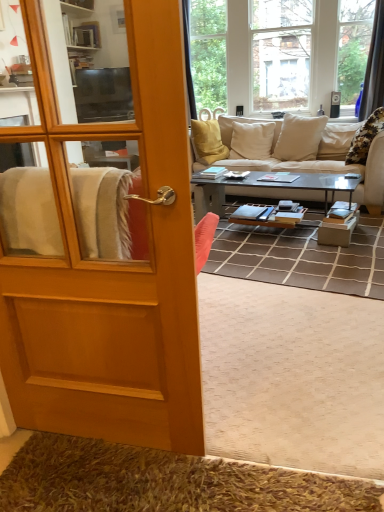
Find the location of a particular element. brown shaggy rug at lower left is located at coordinates (163, 482).

Measure the distance between brown shaggy rug at lower left and camera.

brown shaggy rug at lower left and camera are 4.08 feet apart from each other.

What do you see at coordinates (103, 95) in the screenshot?
I see `matte black television at upper left` at bounding box center [103, 95].

What do you see at coordinates (113, 265) in the screenshot? I see `wooden door at left` at bounding box center [113, 265].

At what (x,y) coordinates should I click in order to perform the action: click on wooden door at left. Please return your answer as a coordinate pair (x, y). Looking at the image, I should click on (113, 265).

Measure the distance between metallic gray coffee table at center and camera.

metallic gray coffee table at center is 3.06 meters from camera.

What do you see at coordinates (325, 168) in the screenshot?
I see `beige fabric couch at center` at bounding box center [325, 168].

Find the location of `beige fabric couch at center`. beige fabric couch at center is located at coordinates (325, 168).

In order to click on brown shaggy rug at lower left in this screenshot , I will do `click(163, 482)`.

In the scene shown: Is metallic gray coffee table at center situated inside matte black television at upper left or outside?

metallic gray coffee table at center is not inside matte black television at upper left, it's outside.

Which is closer, (203, 195) or (78, 77)?

Point (203, 195) is positioned closer to the camera compared to point (78, 77).

Does metallic gray coffee table at center appear on the right side of matte black television at upper left?

Correct, you'll find metallic gray coffee table at center to the right of matte black television at upper left.

Does metallic gray coffee table at center lie in front of matte black television at upper left?

Yes, the depth of metallic gray coffee table at center is less than that of matte black television at upper left.

Based on the photo, is matte black television at upper left aimed at beige fabric couch at center?

Yes.

Which is further, (77, 117) or (260, 189)?

The point (77, 117) is more distant.

Is matte black television at upper left further to the viewer compared to beige fabric couch at center?

Yes, the depth of matte black television at upper left is greater than that of beige fabric couch at center.

Which of these two, matte black television at upper left or beige fabric couch at center, is bigger?

beige fabric couch at center.

Is brown shaggy rug at lower left surrounding metallic gray coffee table at center?

No.

Does point (259, 510) come in front of point (261, 187)?

Yes.

Is metallic gray coffee table at center at the back of brown shaggy rug at lower left?

No, metallic gray coffee table at center is not at the back of brown shaggy rug at lower left.

In the scene shown: Who is taller, brown shaggy rug at lower left or metallic gray coffee table at center?

metallic gray coffee table at center.

In the scene shown: Is matte black television at upper left looking in the opposite direction of metallic gray coffee table at center?

No, matte black television at upper left is not facing away from metallic gray coffee table at center.

Measure the distance from matte black television at upper left to metallic gray coffee table at center.

8.08 feet.

Are matte black television at upper left and metallic gray coffee table at center beside each other?

No.

Is matte black television at upper left thinner than metallic gray coffee table at center?

Correct, the width of matte black television at upper left is less than that of metallic gray coffee table at center.

Is wooden door at left smaller than metallic gray coffee table at center?

Yes.

Considering the sizes of objects wooden door at left and metallic gray coffee table at center in the image provided, who is taller, wooden door at left or metallic gray coffee table at center?

Standing taller between the two is wooden door at left.

Looking at this image, what's the angular difference between wooden door at left and metallic gray coffee table at center's facing directions?

wooden door at left and metallic gray coffee table at center are facing 9.17 degrees away from each other.

Are metallic gray coffee table at center and beige fabric couch at center far apart?

metallic gray coffee table at center is near beige fabric couch at center, not far away.

Does metallic gray coffee table at center appear on the right side of beige fabric couch at center?

No.

Is beige fabric couch at center at the back of metallic gray coffee table at center?

No.

Is beige fabric couch at center not close to wooden door at left?

beige fabric couch at center is positioned a significant distance from wooden door at left.

Can you confirm if beige fabric couch at center is wider than wooden door at left?

Indeed, beige fabric couch at center has a greater width compared to wooden door at left.

Find the location of a particular element. The width and height of the screenshot is (384, 512). door in front of the beige fabric couch at center is located at coordinates (113, 265).

At what (x,y) coordinates should I click in order to perform the action: click on coffee table located below the matte black television at upper left (from the image's perspective). Please return your answer as a coordinate pair (x, y). This screenshot has width=384, height=512. Looking at the image, I should click on (265, 188).

Image resolution: width=384 pixels, height=512 pixels. Find the location of `studio couch lying in front of the matte black television at upper left`. studio couch lying in front of the matte black television at upper left is located at coordinates (325, 168).

Estimate the real-world distances between objects in this image. Which object is closer to metallic gray coffee table at center, brown shaggy rug at lower left or wooden door at left?

wooden door at left is positioned closer to the anchor metallic gray coffee table at center.

Which object lies nearer to the anchor point matte black television at upper left, brown shaggy rug at lower left or metallic gray coffee table at center?

metallic gray coffee table at center is closer to matte black television at upper left.

Based on the photo, considering their positions, is wooden door at left positioned further to metallic gray coffee table at center than beige fabric couch at center?

wooden door at left is further to metallic gray coffee table at center.

When comparing their distances from metallic gray coffee table at center, does beige fabric couch at center or brown shaggy rug at lower left seem closer?

beige fabric couch at center.

Estimate the real-world distances between objects in this image. Which object is closer to wooden door at left, matte black television at upper left or brown shaggy rug at lower left?

brown shaggy rug at lower left is positioned closer to the anchor wooden door at left.

When comparing their distances from brown shaggy rug at lower left, does matte black television at upper left or wooden door at left seem further?

matte black television at upper left is positioned further to the anchor brown shaggy rug at lower left.

Estimate the real-world distances between objects in this image. Which object is further from brown shaggy rug at lower left, beige fabric couch at center or metallic gray coffee table at center?

Based on the image, beige fabric couch at center appears to be further to brown shaggy rug at lower left.

Based on their spatial positions, is metallic gray coffee table at center or matte black television at upper left further from wooden door at left?

matte black television at upper left is positioned further to the anchor wooden door at left.

Find the location of a particular element. The width and height of the screenshot is (384, 512). coffee table between brown shaggy rug at lower left and beige fabric couch at center along the z-axis is located at coordinates click(265, 188).

The width and height of the screenshot is (384, 512). Identify the location of studio couch between wooden door at left and matte black television at upper left from front to back. (325, 168).

Where is `coffee table located between matte black television at upper left and beige fabric couch at center in the left-right direction`? coffee table located between matte black television at upper left and beige fabric couch at center in the left-right direction is located at coordinates (265, 188).

Identify the location of coffee table positioned between brown shaggy rug at lower left and matte black television at upper left from near to far. The image size is (384, 512). (265, 188).